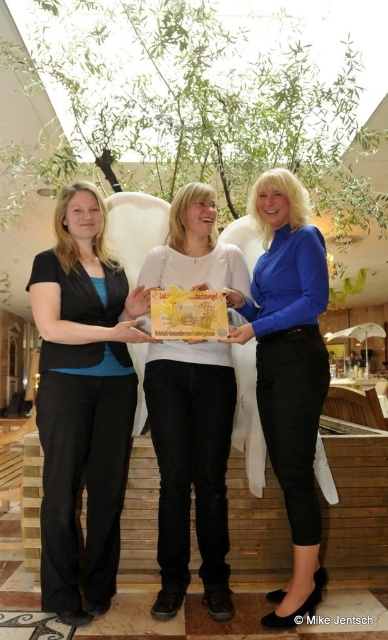
You are standing in the same room as the women holding the gift box. The room has a coordinate system where the bottom left corner is the origin. The gift box is at point (190,467). If you are standing at point 0.5, 0.5, which direction should you move to reach the gift box?

The white matte gift box at center is located at point (190,467). Since your current position is at 0.5, 0.5, you should move northeast to reach the gift box.

You are an interior designer analyzing the image. You need to determine the exact position of the matte black pants at left in the image. What are their coordinates?

The coordinates of the matte black pants at left are at point [83,401].